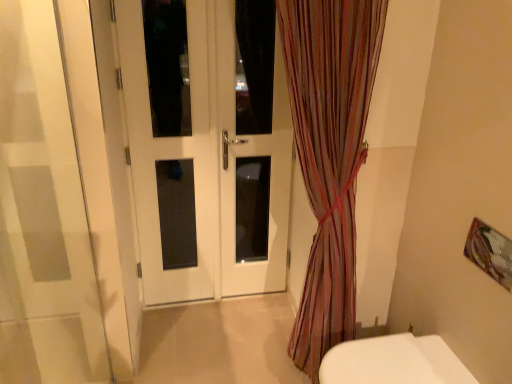
What are the coordinates of `free space in front of white glass door at center` in the screenshot? It's located at (247, 334).